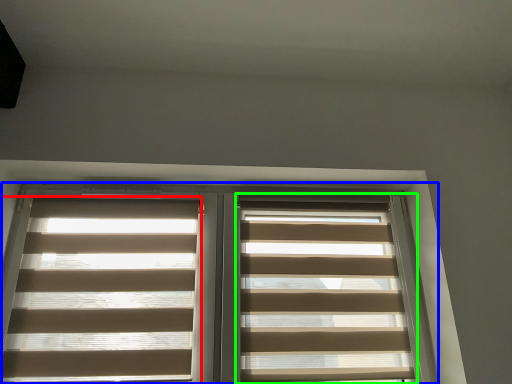
Question: Which is nearer to the window blind (highlighted by a red box)? window (highlighted by a blue box) or window blind (highlighted by a green box).

Choices:
 (A) window
 (B) window blind

Answer: (A)